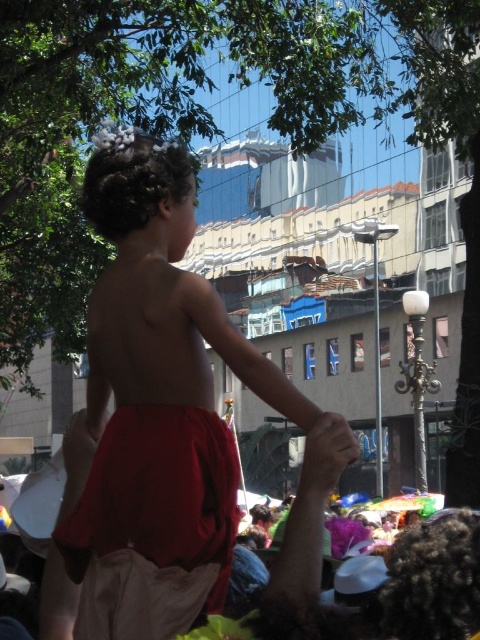
Who is positioned more to the left, red fabric at center or smooth skin hand at center?

red fabric at center is more to the left.

Which of these two, red fabric at center or smooth skin hand at center, stands shorter?

smooth skin hand at center is shorter.

Who is more forward, (x=286, y=608) or (x=308, y=456)?

Point (x=286, y=608)

You are a GUI agent. You are given a task and a screenshot of the screen. Output one action in this format:
    pyautogui.click(x=<x>, y=<y>)
    Task: Click on the red fabric at center
    The image size is (480, 640).
    Given the screenshot: What is the action you would take?
    pyautogui.click(x=298, y=563)

Can you confirm if red cotton shorts at center is smaller than smooth skin hand at center?

Actually, red cotton shorts at center might be larger than smooth skin hand at center.

Is red cotton shorts at center to the right of smooth skin hand at center from the viewer's perspective?

In fact, red cotton shorts at center is to the left of smooth skin hand at center.

Between point (236, 472) and point (308, 461), which one is positioned in front?

Point (308, 461)

In order to click on red cotton shorts at center in this screenshot , I will do tap(156, 406).

Does red cotton shorts at center appear on the left side of red fabric at center?

Indeed, red cotton shorts at center is positioned on the left side of red fabric at center.

Can you confirm if red cotton shorts at center is positioned below red fabric at center?

No, red cotton shorts at center is not below red fabric at center.

The width and height of the screenshot is (480, 640). In order to click on red cotton shorts at center in this screenshot , I will do `click(156, 406)`.